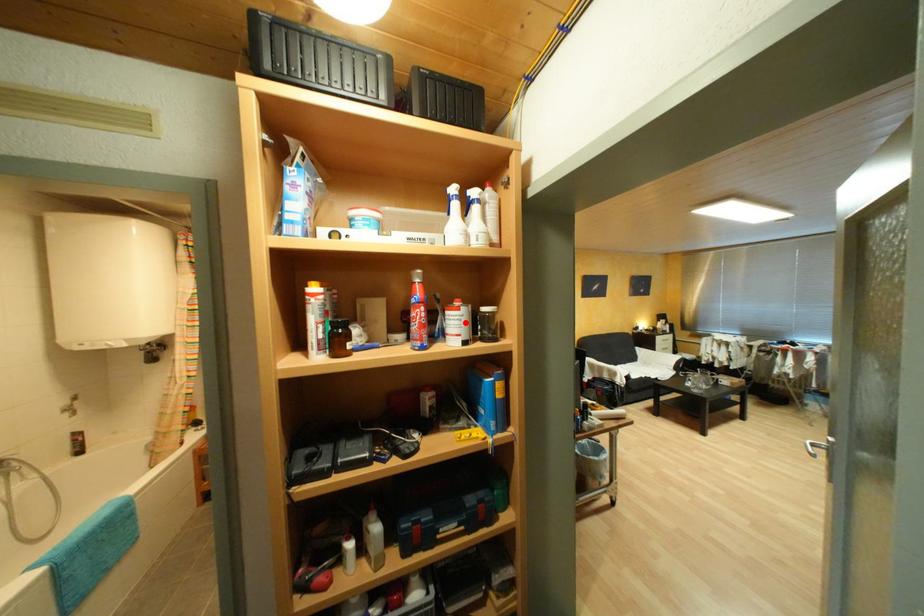
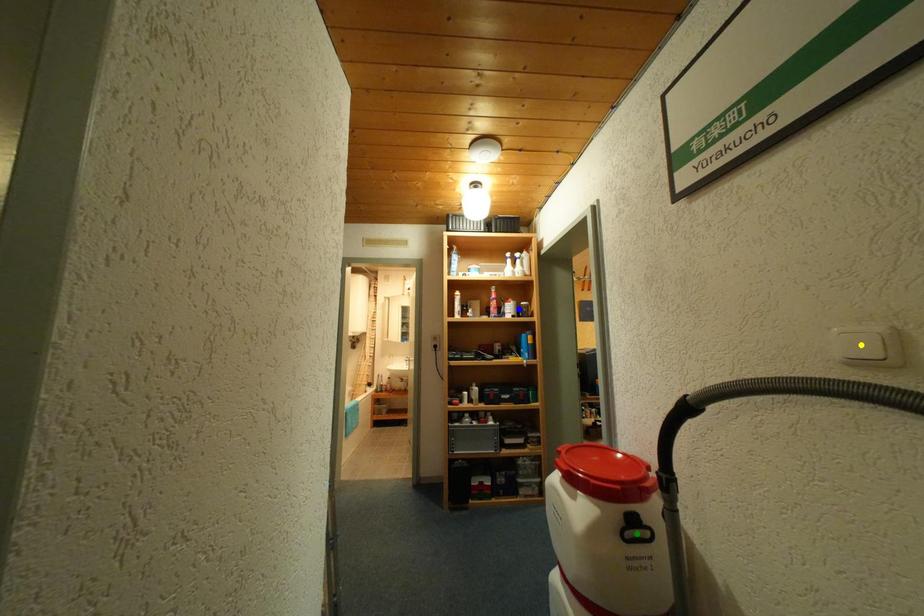
Question: I am providing you with two images of the same scene from different viewpoints. A red point is marked on the first image. You are given multiple points on the second image. Which mark in image 2 goes with the point in image 1?

Choices:
 (A) green point
 (B) yellow point
 (C) blue point

Answer: (C)